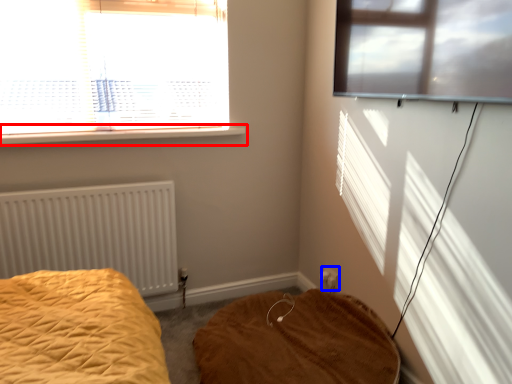
Question: Among these objects, which one is nearest to the camera, window sill (highlighted by a red box) or electric outlet (highlighted by a blue box)?

Choices:
 (A) window sill
 (B) electric outlet

Answer: (A)